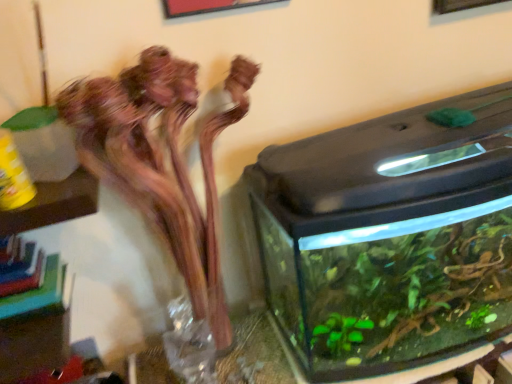
Question: Does transparent glass vase at center have a greater width compared to translucent glass vase at left?

Choices:
 (A) no
 (B) yes

Answer: (A)

Question: Considering the relative sizes of transparent glass vase at center and translucent glass vase at left in the image provided, is transparent glass vase at center bigger than translucent glass vase at left?

Choices:
 (A) no
 (B) yes

Answer: (A)

Question: From a real-world perspective, is transparent glass vase at center located higher than translucent glass vase at left?

Choices:
 (A) no
 (B) yes

Answer: (A)

Question: Does transparent glass vase at center have a smaller size compared to translucent glass vase at left?

Choices:
 (A) yes
 (B) no

Answer: (A)

Question: Are transparent glass vase at center and translucent glass vase at left making contact?

Choices:
 (A) no
 (B) yes

Answer: (A)

Question: Considering the relative sizes of transparent glass vase at center and translucent glass vase at left in the image provided, is transparent glass vase at center taller than translucent glass vase at left?

Choices:
 (A) no
 (B) yes

Answer: (A)

Question: Is translucent glass vase at left to the right of transparent glass water tank at right from the viewer's perspective?

Choices:
 (A) yes
 (B) no

Answer: (B)

Question: Would you say translucent glass vase at left is outside transparent glass water tank at right?

Choices:
 (A) yes
 (B) no

Answer: (A)

Question: Does translucent glass vase at left have a greater width compared to transparent glass water tank at right?

Choices:
 (A) no
 (B) yes

Answer: (A)

Question: Can you confirm if translucent glass vase at left is smaller than transparent glass water tank at right?

Choices:
 (A) yes
 (B) no

Answer: (A)

Question: From the image's perspective, is translucent glass vase at left on transparent glass water tank at right?

Choices:
 (A) no
 (B) yes

Answer: (A)

Question: From a real-world perspective, does translucent glass vase at left sit lower than transparent glass water tank at right?

Choices:
 (A) no
 (B) yes

Answer: (A)

Question: Is transparent glass water tank at right surrounding translucent glass vase at left?

Choices:
 (A) yes
 (B) no

Answer: (B)